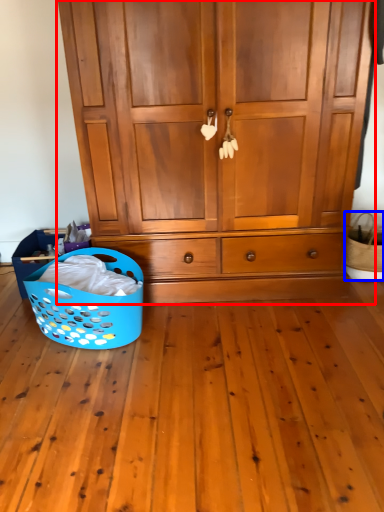
Question: Which object appears farthest to the camera in this image, cupboard (highlighted by a red box) or basket (highlighted by a blue box)?

Choices:
 (A) cupboard
 (B) basket

Answer: (B)